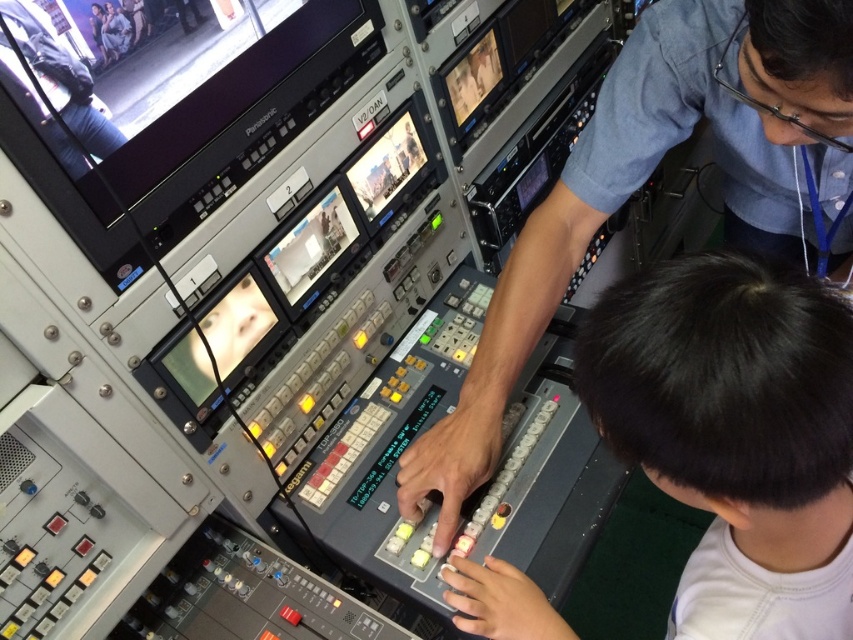
You are a technician standing in front of the video mixing console and need to adjust a setting on the dark hair at center. Can you reach it without moving your position?

The dark hair at center is 17.69 inches away from the camera, but since you are a technician standing in front of the console, the distance from your hand to the dark hair at center would depend on your arm length. However, typical arm reach for an adult is about 24 to 30 inches, so it is likely within reach without moving your position.

You are a technician in a broadcast control room. You need to identify which object takes up more space in the scene between the dark hair at center and the matte black pants at upper left. Which one is larger?

The dark hair at center is bigger than the matte black pants at upper left, so the dark hair at center takes up more space in the scene.

You are a technician in the broadcast control room. You need to adjust a setting on the metallic gray control panel at center and also check the status of the matte black pants at upper left. Which object should you approach first if you want to work on the larger one?

The metallic gray control panel at center is larger in size than the matte black pants at upper left, so you should approach the metallic gray control panel at center first.